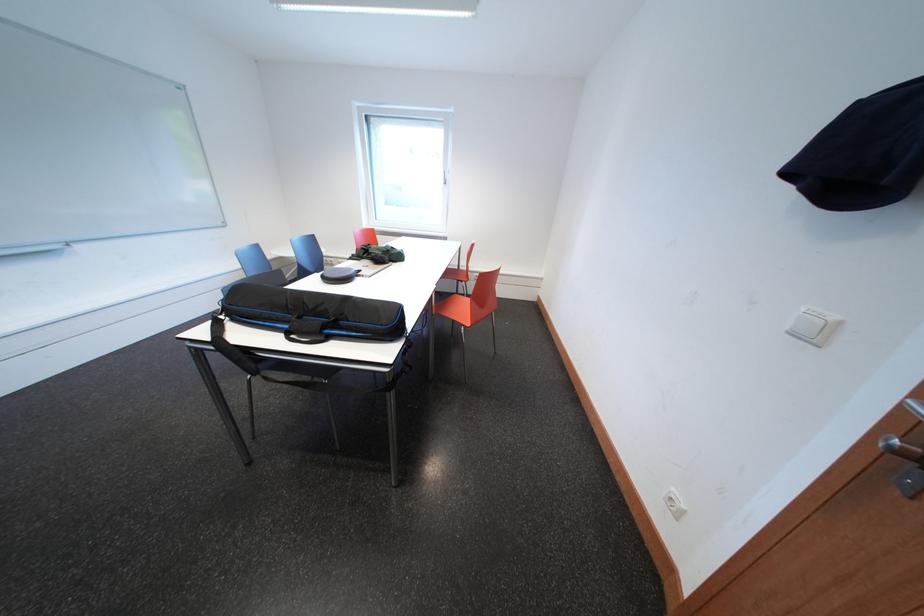
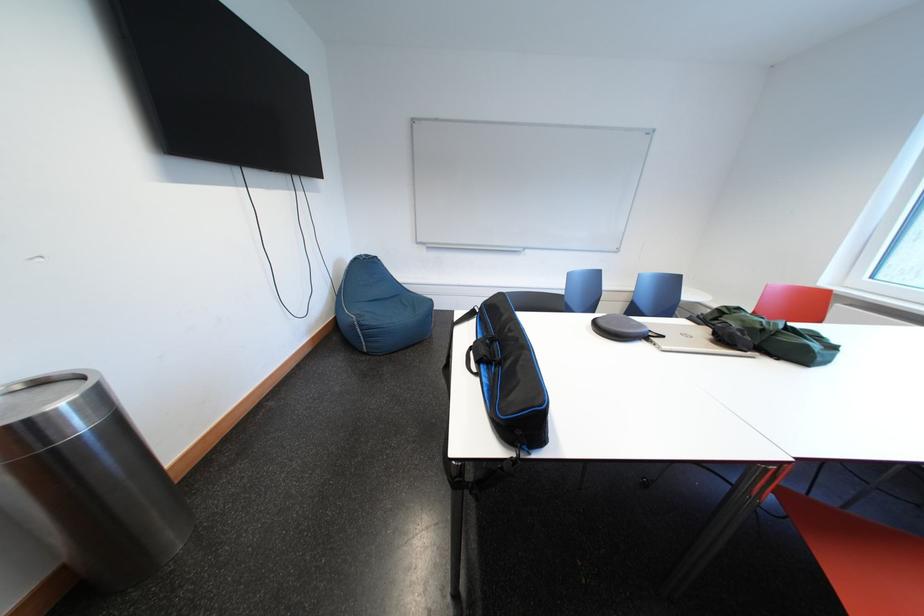
Question: Based on the continuous images, in which direction is the camera rotating? Reply with the corresponding letter.

Choices:
 (A) Left
 (B) Right
 (C) Up
 (D) Down

Answer: (A)